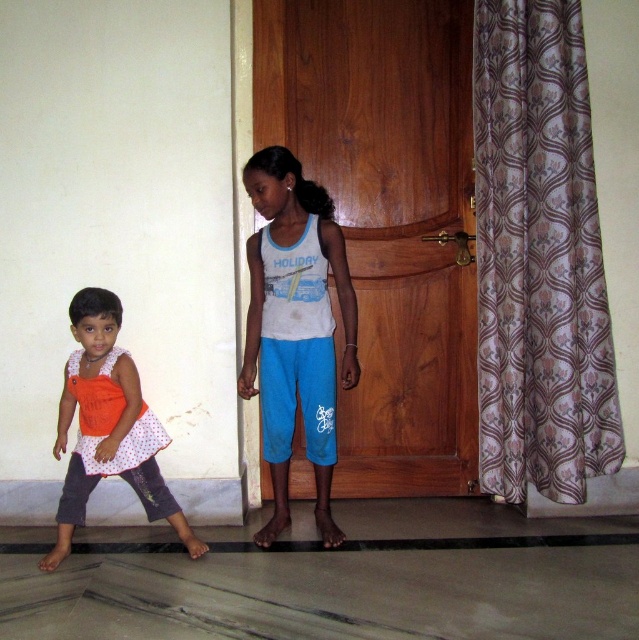
Between point (403, 147) and point (477, 163), which one is positioned in front?

Point (477, 163)

Does wooden door at center appear under floral-patterned fabric at right?

Correct, wooden door at center is located below floral-patterned fabric at right.

Does point (254, 92) come closer to viewer compared to point (491, 392)?

No, it is behind (491, 392).

This screenshot has width=639, height=640. What are the coordinates of `wooden door at center` in the screenshot? It's located at (387, 218).

Who is more forward, (470,77) or (112,401)?

Positioned in front is point (112,401).

Between point (325, 28) and point (42, 561), which one is positioned behind?

Point (325, 28)

This screenshot has width=639, height=640. Identify the location of wooden door at center. (387, 218).

Is white cotton tank top at center closer to the viewer compared to orange dotted dress at lower left?

No, white cotton tank top at center is behind orange dotted dress at lower left.

Which is above, white cotton tank top at center or orange dotted dress at lower left?

white cotton tank top at center

Does point (284, 211) lie behind point (84, 358)?

That is False.

You are a GUI agent. You are given a task and a screenshot of the screen. Output one action in this format:
    pyautogui.click(x=<x>, y=<y>)
    Task: Click on the white cotton tank top at center
    Image resolution: width=639 pixels, height=640 pixels.
    Given the screenshot: What is the action you would take?
    pyautogui.click(x=295, y=326)